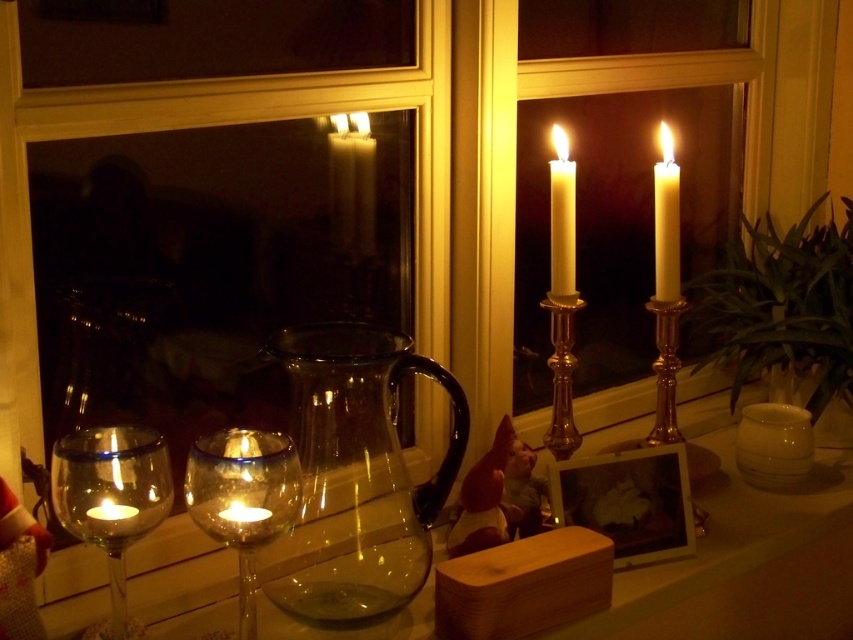
Measure the distance between transparent glass window at center and white wax candle at upper left.

They are 7.60 inches apart.

Between transparent glass window at center and white wax candle at upper left, which one has more height?

Standing taller between the two is transparent glass window at center.

Find the location of a particular element. transparent glass window at center is located at coordinates (212, 124).

Can you confirm if white wax candle at upper right is positioned to the right of white wax candle at upper left?

Indeed, white wax candle at upper right is positioned on the right side of white wax candle at upper left.

What do you see at coordinates (561, 221) in the screenshot?
I see `white wax candle at upper right` at bounding box center [561, 221].

Does point (555, 225) lie behind point (338, 230)?

No, it is not.

The height and width of the screenshot is (640, 853). I want to click on white wax candle at upper right, so click(561, 221).

Can you confirm if clear glass candle at center is wider than white glossy candle holder at lower right?

Correct, the width of clear glass candle at center exceeds that of white glossy candle holder at lower right.

Who is more distant from viewer, (242, 545) or (750, 420)?

Point (750, 420)

Find the location of a particular element. Image resolution: width=853 pixels, height=640 pixels. clear glass candle at center is located at coordinates (242, 499).